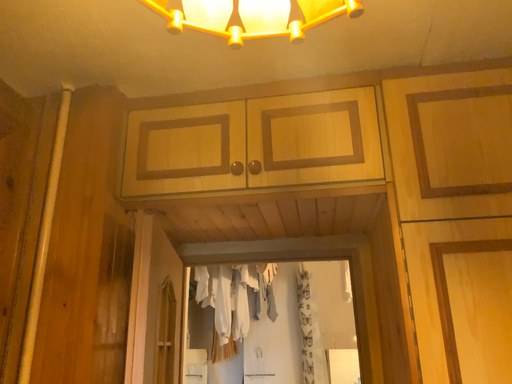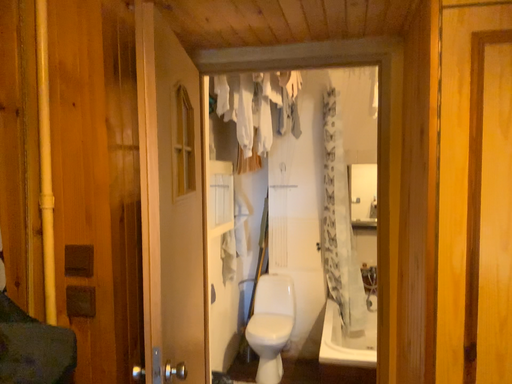
Question: Which way did the camera rotate in the video?

Choices:
 (A) rotated upward
 (B) rotated downward

Answer: (B)